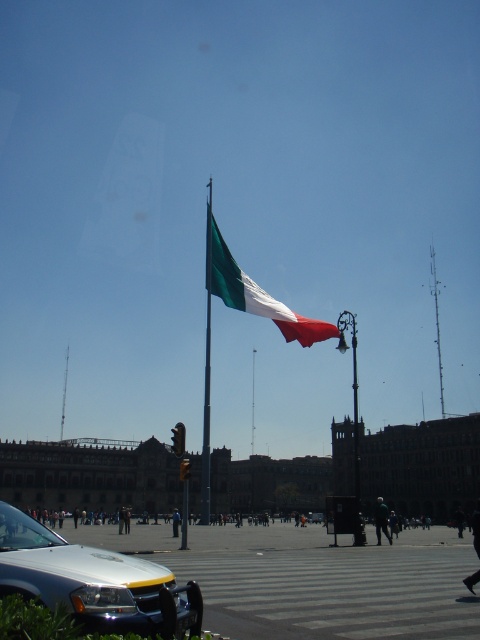
Is point (55, 598) closer to camera compared to point (66, 365)?

Yes, it is.

Is silver metallic car at lower left taller than metallic tower at upper center?

In fact, silver metallic car at lower left may be shorter than metallic tower at upper center.

Image resolution: width=480 pixels, height=640 pixels. I want to click on silver metallic car at lower left, so click(94, 580).

Locate an element on the screen. This screenshot has height=640, width=480. silver metallic car at lower left is located at coordinates (94, 580).

Looking at this image, does silver metallic car at lower left have a greater height compared to metallic flag pole at center?

No.

Is point (146, 580) farther from viewer compared to point (210, 385)?

That is False.

Locate an element on the screen. silver metallic car at lower left is located at coordinates (94, 580).

Can you confirm if metallic silver mast at upper right is wider than metallic tower at upper center?

Indeed, metallic silver mast at upper right has a greater width compared to metallic tower at upper center.

Between metallic silver mast at upper right and metallic tower at upper center, which one has more height?

metallic silver mast at upper right

The image size is (480, 640). Identify the location of metallic silver mast at upper right. (436, 323).